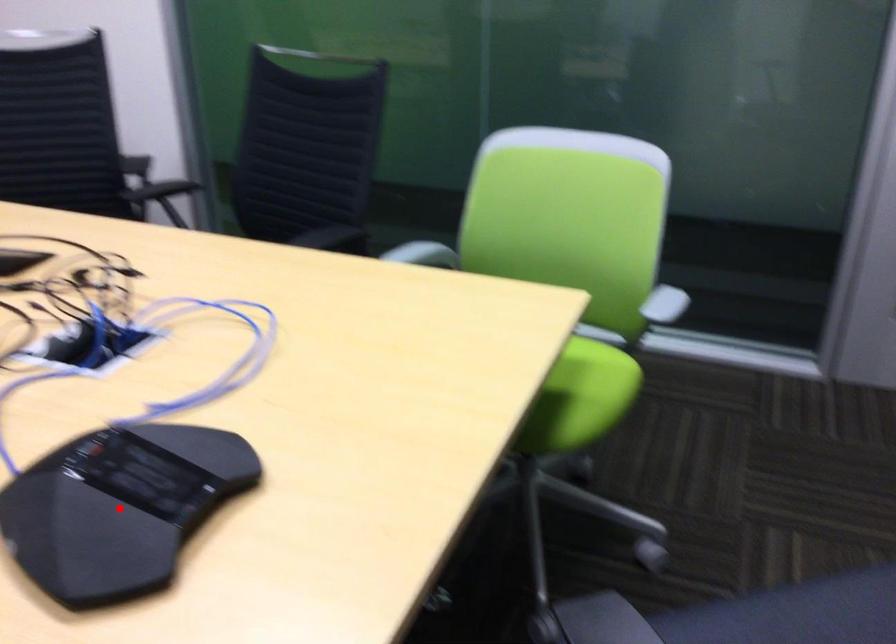
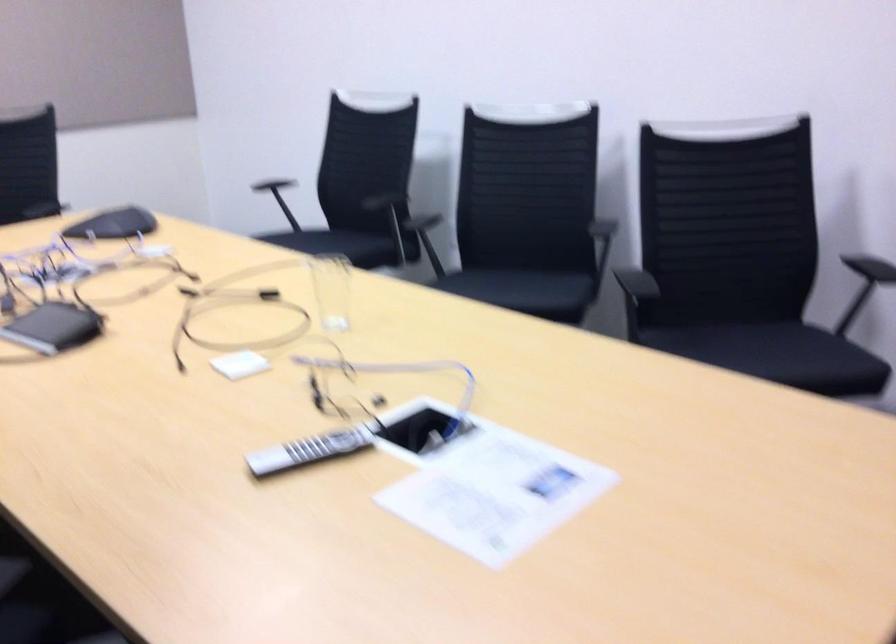
Question: I am providing you with two images of the same scene from different viewpoints. A red point is marked on the first image. At the location where the point appears in image 1, is it still visible in image 2?

Choices:
 (A) Yes
 (B) No

Answer: (B)